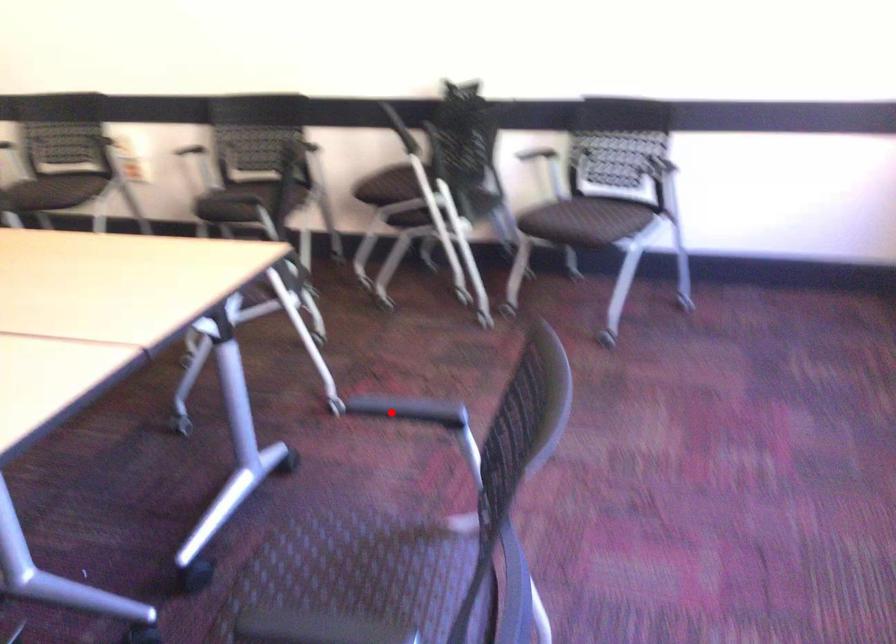
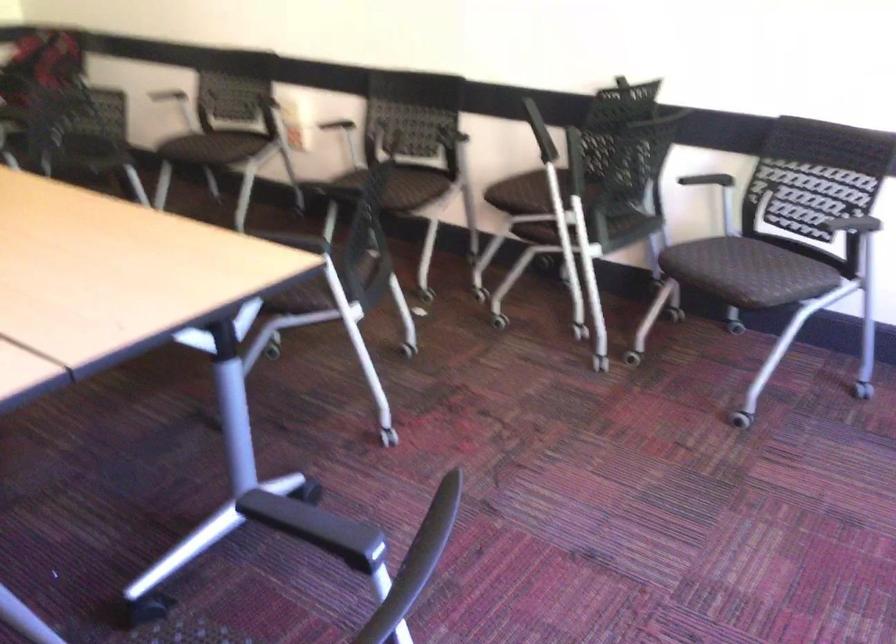
In the second image, find the point that corresponds to the highlighted location in the first image.

(294, 518)